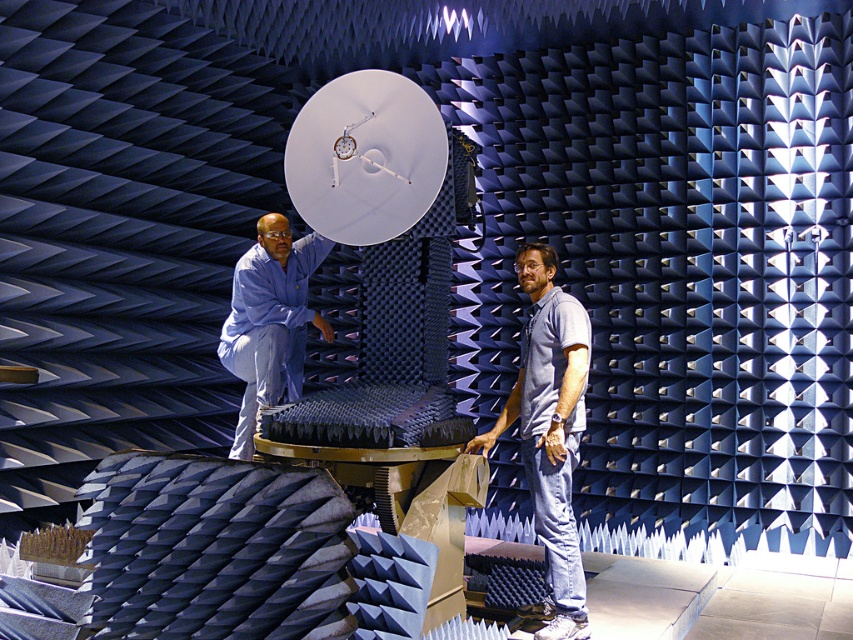
Question: Which point appears farthest from the camera in this image?

Choices:
 (A) click(x=546, y=305)
 (B) click(x=263, y=388)
 (C) click(x=317, y=182)

Answer: (B)

Question: Is light blue denim jeans at center further to camera compared to blue fabric shirt at upper left?

Choices:
 (A) yes
 (B) no

Answer: (B)

Question: Estimate the real-world distances between objects in this image. Which object is farther from the blue fabric shirt at upper left?

Choices:
 (A) white matte satellite at center
 (B) light blue denim jeans at center

Answer: (B)

Question: In this image, where is light blue denim jeans at center located relative to blue fabric shirt at upper left?

Choices:
 (A) below
 (B) above

Answer: (A)

Question: Can you confirm if white matte satellite at center is positioned below blue fabric shirt at upper left?

Choices:
 (A) no
 (B) yes

Answer: (A)

Question: Which of the following is the closest to the observer?

Choices:
 (A) (364, 122)
 (B) (242, 307)

Answer: (A)